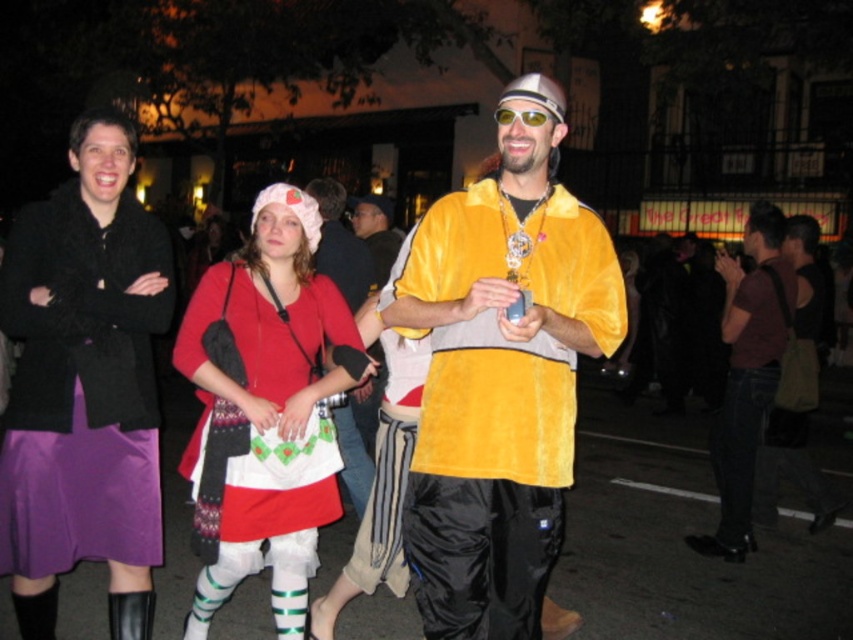
Looking at the image, there are two people wearing capes in the center. One has a velvet gold cape at center and the other has a yellow velvet cape at center. Which of these two capes is positioned to the right?

The velvet gold cape at center is positioned to the right of the yellow velvet cape at center.

You are a photographer at the event and want to capture a photo that includes both the yellow velvet cape at center and the person in the purple skirt. Where should you position the camera to ensure both subjects are in frame?

To include both the yellow velvet cape at center and the person in the purple skirt, position the camera so it can capture the area around the yellow velvet cape at center located at point (340, 244) and the purple skirt person positioned to the left of the cape.